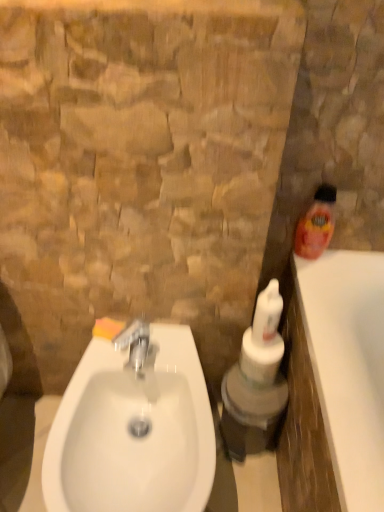
Question: Should I look upward or downward to see orange sponge at sink left?

Choices:
 (A) up
 (B) down

Answer: (B)

Question: Considering the relative sizes of silver metallic faucet at center and white glossy sink at lower left in the image provided, is silver metallic faucet at center thinner than white glossy sink at lower left?

Choices:
 (A) no
 (B) yes

Answer: (B)

Question: Can you confirm if silver metallic faucet at center is positioned to the right of white glossy sink at lower left?

Choices:
 (A) yes
 (B) no

Answer: (A)

Question: Is silver metallic faucet at center turned away from white glossy sink at lower left?

Choices:
 (A) no
 (B) yes

Answer: (A)

Question: From the image's perspective, would you say silver metallic faucet at center is positioned over white glossy sink at lower left?

Choices:
 (A) yes
 (B) no

Answer: (A)

Question: From a real-world perspective, is silver metallic faucet at center on white glossy sink at lower left?

Choices:
 (A) no
 (B) yes

Answer: (B)

Question: Is silver metallic faucet at center taller than white glossy sink at lower left?

Choices:
 (A) no
 (B) yes

Answer: (A)

Question: Does orange plastic bottle at right, the second cleaning product in the left-to-right sequence, appear on the right side of white glossy bottle at center, which is the 2th cleaning product in top-to-bottom order?

Choices:
 (A) yes
 (B) no

Answer: (A)

Question: Is orange plastic bottle at right, the 2th cleaning product from the bottom, looking in the opposite direction of white glossy bottle at center, the first cleaning product when ordered from bottom to top?

Choices:
 (A) yes
 (B) no

Answer: (B)

Question: Is orange plastic bottle at right, the 1th cleaning product viewed from the right, not close to white glossy bottle at center, marked as the 2th cleaning product in a right-to-left arrangement?

Choices:
 (A) yes
 (B) no

Answer: (B)

Question: Considering the relative sizes of orange plastic bottle at right, which ranks as the first cleaning product in top-to-bottom order, and white glossy bottle at center, marked as the 2th cleaning product in a right-to-left arrangement, in the image provided, is orange plastic bottle at right, which ranks as the first cleaning product in top-to-bottom order, smaller than white glossy bottle at center, marked as the 2th cleaning product in a right-to-left arrangement,?

Choices:
 (A) no
 (B) yes

Answer: (A)

Question: Is white glossy bottle at center, marked as the 1th cleaning product in a left-to-right arrangement, completely or partially inside orange plastic bottle at right, which ranks as the first cleaning product in top-to-bottom order?

Choices:
 (A) yes
 (B) no

Answer: (B)

Question: Considering the relative sizes of orange plastic bottle at right, the 1th cleaning product viewed from the right, and white glossy bottle at center, the first cleaning product when ordered from bottom to top, in the image provided, is orange plastic bottle at right, the 1th cleaning product viewed from the right, shorter than white glossy bottle at center, the first cleaning product when ordered from bottom to top,?

Choices:
 (A) no
 (B) yes

Answer: (A)

Question: Is silver metallic faucet at center in contact with white glossy bottle at center, which is the 2th cleaning product in top-to-bottom order?

Choices:
 (A) yes
 (B) no

Answer: (B)